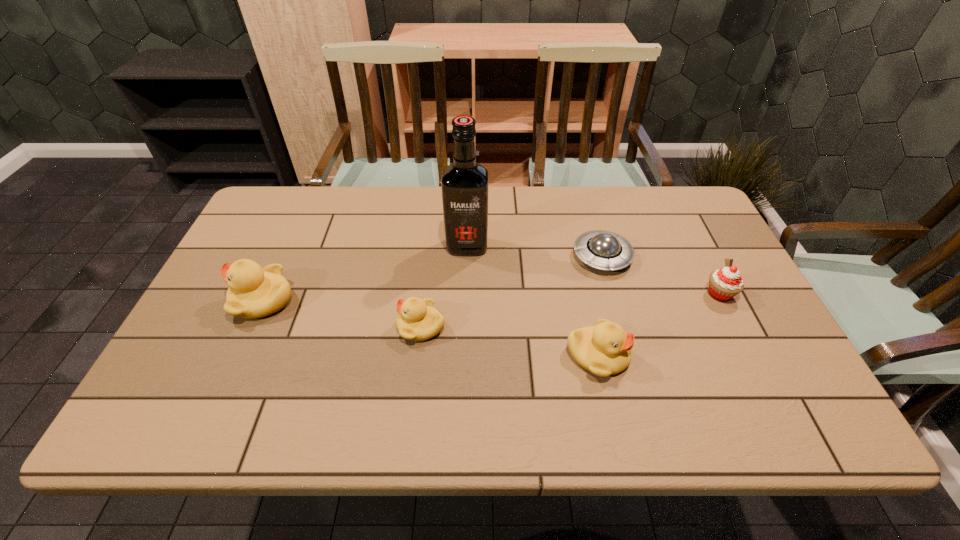
This screenshot has width=960, height=540. In the image, there is a desktop. Find the location of `vacant space at the left edge`. vacant space at the left edge is located at coordinates (214, 326).

Locate an element on the screen. The height and width of the screenshot is (540, 960). vacant space at the right edge is located at coordinates (714, 266).

Find the location of `free space at the far left corner of the desktop`. free space at the far left corner of the desktop is located at coordinates (275, 210).

Locate an element on the screen. This screenshot has width=960, height=540. free space at the far right corner of the desktop is located at coordinates (663, 186).

Where is `unoccupied position between the second shortest duckling and the liquor`? The height and width of the screenshot is (540, 960). unoccupied position between the second shortest duckling and the liquor is located at coordinates (532, 301).

Locate an element on the screen. free space between the leftmost object and the rightmost object is located at coordinates (492, 297).

Where is `free space between the saucer and the shortest duckling`? free space between the saucer and the shortest duckling is located at coordinates (512, 291).

Where is `free space between the second tallest duckling and the cupcake`? The width and height of the screenshot is (960, 540). free space between the second tallest duckling and the cupcake is located at coordinates (659, 325).

Where is `vacant space that is in between the fifth tallest object and the rightmost object`? The height and width of the screenshot is (540, 960). vacant space that is in between the fifth tallest object and the rightmost object is located at coordinates (570, 310).

Locate an element on the screen. vacant area that lies between the leftmost duckling and the second duckling from right to left is located at coordinates (343, 313).